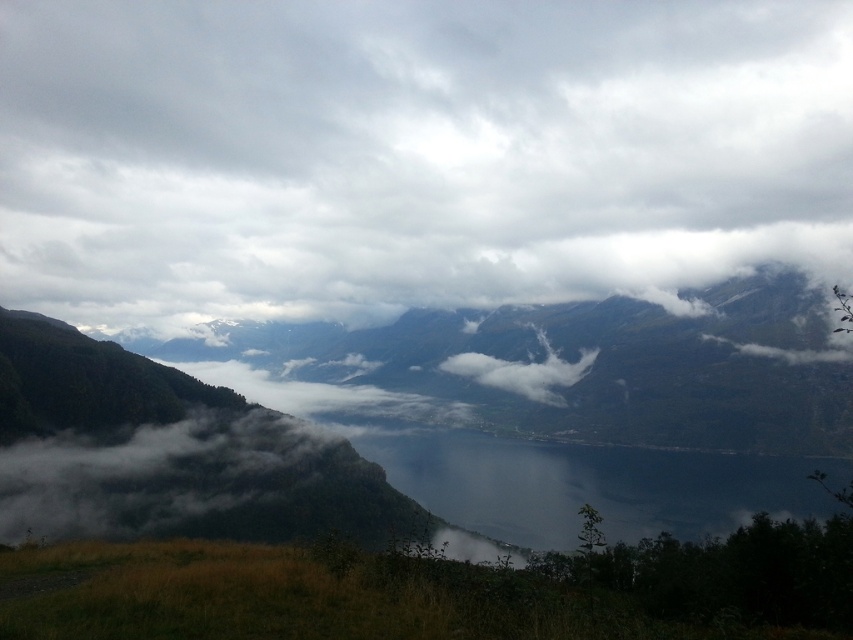
Question: Which object is positioned farthest from the dark blue water at center?

Choices:
 (A) white fluffy cloud at center
 (B) green textured mountain at center
 (C) green grassy field at lower left
 (D) cloudy sky at upper center

Answer: (D)

Question: Does green textured mountain at center appear under white fluffy cloud at center?

Choices:
 (A) yes
 (B) no

Answer: (B)

Question: Which of the following is the farthest from the observer?

Choices:
 (A) (410, 369)
 (B) (804, 150)

Answer: (B)

Question: Which object is positioned farthest from the cloudy sky at upper center?

Choices:
 (A) green textured mountain at center
 (B) dark blue water at center
 (C) white fluffy cloud at center
 (D) green grassy field at lower left

Answer: (D)

Question: Can you confirm if green grassy field at lower left is smaller than dark blue water at center?

Choices:
 (A) no
 (B) yes

Answer: (B)

Question: Is green grassy field at lower left thinner than white fluffy cloud at center?

Choices:
 (A) yes
 (B) no

Answer: (A)